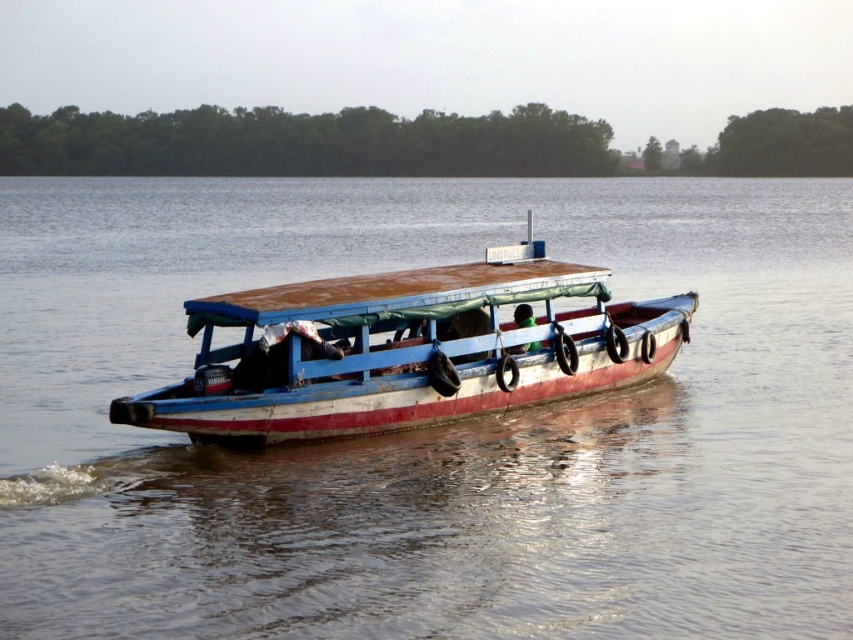
Question: Is brown wooden boat at center positioned before rusty metal boat at center?

Choices:
 (A) yes
 (B) no

Answer: (A)

Question: Is brown wooden boat at center in front of rusty metal boat at center?

Choices:
 (A) yes
 (B) no

Answer: (A)

Question: Is brown wooden boat at center below rusty metal boat at center?

Choices:
 (A) yes
 (B) no

Answer: (B)

Question: Which point is closer to the camera taking this photo?

Choices:
 (A) (38, 632)
 (B) (440, 323)

Answer: (A)